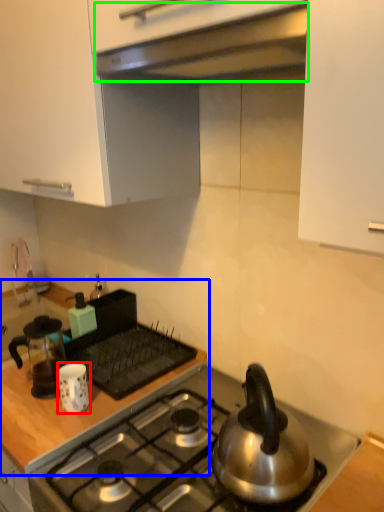
Question: Which object is positioned farthest from kitchen appliance (highlighted by a red box)? Select from countertop (highlighted by a blue box) and exhaust hood (highlighted by a green box).

Choices:
 (A) countertop
 (B) exhaust hood

Answer: (B)